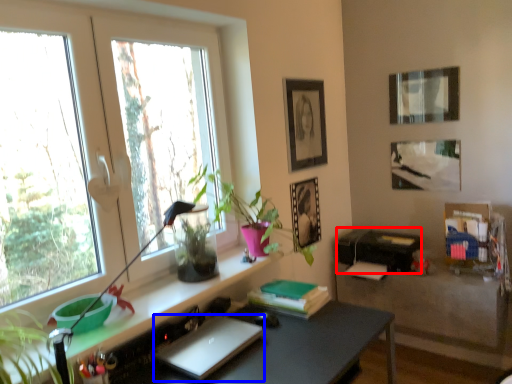
Question: Which of the following is the farthest to the observer, printer (highlighted by a red box) or laptop (highlighted by a blue box)?

Choices:
 (A) printer
 (B) laptop

Answer: (A)